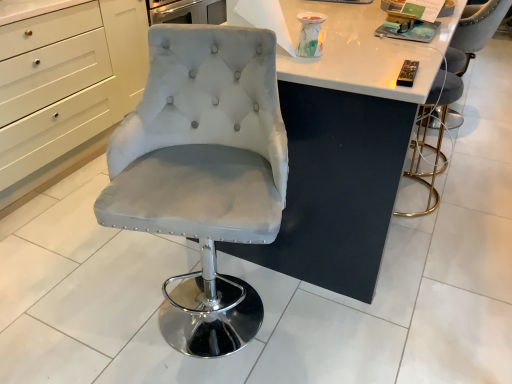
Question: Considering the relative sizes of satin white chair at center, arranged as the first chair when viewed from the front, and black plastic remote control at upper right, arranged as the 2th magazine when viewed from the back, in the image provided, is satin white chair at center, arranged as the first chair when viewed from the front, thinner than black plastic remote control at upper right, arranged as the 2th magazine when viewed from the back,?

Choices:
 (A) yes
 (B) no

Answer: (B)

Question: From the image's perspective, is satin white chair at center, arranged as the 3th chair when viewed from the right, below black plastic remote control at upper right, the first magazine positioned from the bottom?

Choices:
 (A) no
 (B) yes

Answer: (B)

Question: From the image's perspective, is satin white chair at center, arranged as the first chair when viewed from the front, over black plastic remote control at upper right, the first magazine positioned from the bottom?

Choices:
 (A) no
 (B) yes

Answer: (A)

Question: Is satin white chair at center, which is counted as the 1th chair, starting from the left, positioned behind black plastic remote control at upper right, positioned as the 1th magazine in front-to-back order?

Choices:
 (A) yes
 (B) no

Answer: (B)

Question: Is satin white chair at center, arranged as the 3th chair when viewed from the back, positioned beyond the bounds of black plastic remote control at upper right, the first magazine positioned from the bottom?

Choices:
 (A) yes
 (B) no

Answer: (A)

Question: Looking at the image, does metallic gold bar stool at right, positioned as the second chair in back-to-front order, seem bigger or smaller compared to matte gray magazine at upper right, the first magazine viewed from the back?

Choices:
 (A) big
 (B) small

Answer: (A)

Question: In terms of width, does metallic gold bar stool at right, positioned as the second chair in back-to-front order, look wider or thinner when compared to matte gray magazine at upper right, positioned as the 2th magazine in bottom-to-top order?

Choices:
 (A) wide
 (B) thin

Answer: (A)

Question: Do you think metallic gold bar stool at right, the 2th chair from the front, is within matte gray magazine at upper right, the first magazine viewed from the back, or outside of it?

Choices:
 (A) outside
 (B) inside

Answer: (A)

Question: Is point (431, 196) closer or farther from the camera than point (376, 31)?

Choices:
 (A) farther
 (B) closer

Answer: (A)

Question: From the image's perspective, relative to metallic gold bar stool at right, the 2th chair viewed from the right, is satin white chair at center, which is counted as the 1th chair, starting from the left, above or below?

Choices:
 (A) above
 (B) below

Answer: (B)

Question: Would you say satin white chair at center, which is counted as the 1th chair, starting from the left, is inside or outside metallic gold bar stool at right, arranged as the 2th chair when viewed from the left?

Choices:
 (A) inside
 (B) outside

Answer: (B)

Question: Considering the relative positions of satin white chair at center, arranged as the 3th chair when viewed from the back, and metallic gold bar stool at right, positioned as the second chair in back-to-front order, in the image provided, is satin white chair at center, arranged as the 3th chair when viewed from the back, to the left or to the right of metallic gold bar stool at right, positioned as the second chair in back-to-front order,?

Choices:
 (A) right
 (B) left

Answer: (B)

Question: Considering the positions of satin white chair at center, arranged as the 3th chair when viewed from the back, and metallic gold bar stool at right, the 2th chair viewed from the right, in the image, is satin white chair at center, arranged as the 3th chair when viewed from the back, bigger or smaller than metallic gold bar stool at right, the 2th chair viewed from the right,?

Choices:
 (A) big
 (B) small

Answer: (A)

Question: From the image's perspective, relative to metallic gold bar stool at right, arranged as the 2th chair when viewed from the left, is black plastic remote control at upper right, arranged as the 2th magazine when viewed from the back, above or below?

Choices:
 (A) below
 (B) above

Answer: (B)

Question: In the image, is black plastic remote control at upper right, arranged as the second magazine when viewed from the top, positioned in front of or behind metallic gold bar stool at right, positioned as the second chair in back-to-front order?

Choices:
 (A) behind
 (B) front

Answer: (B)